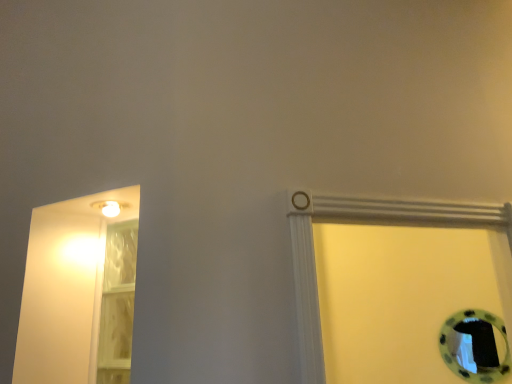
This screenshot has height=384, width=512. Describe the element at coordinates (117, 303) in the screenshot. I see `transparent plastic door at left` at that location.

Identify the location of transparent plastic door at left. The width and height of the screenshot is (512, 384). (117, 303).

Image resolution: width=512 pixels, height=384 pixels. I want to click on white glossy light fixture at upper left, so click(110, 207).

What do you see at coordinates (110, 207) in the screenshot?
I see `white glossy light fixture at upper left` at bounding box center [110, 207].

Locate an element on the screen. transparent plastic door at left is located at coordinates (117, 303).

Considering the relative positions of transparent plastic door at left and white glossy light fixture at upper left in the image provided, is transparent plastic door at left to the left of white glossy light fixture at upper left from the viewer's perspective?

No, transparent plastic door at left is not to the left of white glossy light fixture at upper left.

Consider the image. Is transparent plastic door at left in front of or behind white glossy light fixture at upper left in the image?

In the image, transparent plastic door at left appears behind white glossy light fixture at upper left.

Is point (124, 294) farther from camera compared to point (102, 209)?

Yes, it is behind point (102, 209).

From the image's perspective, relative to white glossy light fixture at upper left, is transparent plastic door at left above or below?

From the image's perspective, transparent plastic door at left appears below white glossy light fixture at upper left.

From a real-world perspective, who is located lower, transparent plastic door at left or white glossy light fixture at upper left?

In real-world perspective, transparent plastic door at left is lower.

Is transparent plastic door at left wider than white glossy light fixture at upper left?

Incorrect, the width of transparent plastic door at left does not surpass that of white glossy light fixture at upper left.

Considering the sizes of objects transparent plastic door at left and white glossy light fixture at upper left in the image provided, who is shorter, transparent plastic door at left or white glossy light fixture at upper left?

With less height is white glossy light fixture at upper left.

Considering the relative sizes of transparent plastic door at left and white glossy light fixture at upper left in the image provided, is transparent plastic door at left bigger than white glossy light fixture at upper left?

Indeed, transparent plastic door at left has a larger size compared to white glossy light fixture at upper left.

Could white glossy light fixture at upper left be considered to be inside transparent plastic door at left?

No, white glossy light fixture at upper left is located outside of transparent plastic door at left.

Is transparent plastic door at left in contact with white glossy light fixture at upper left?

transparent plastic door at left and white glossy light fixture at upper left are clearly separated.

Could you tell me if transparent plastic door at left is facing white glossy light fixture at upper left?

Yes, transparent plastic door at left is facing white glossy light fixture at upper left.

Can you tell me how much transparent plastic door at left and white glossy light fixture at upper left differ in facing direction?

transparent plastic door at left and white glossy light fixture at upper left are facing 2.41 degrees away from each other.

Measure the distance from transparent plastic door at left to white glossy light fixture at upper left.

A distance of 11.19 inches exists between transparent plastic door at left and white glossy light fixture at upper left.

I want to click on glass door that is under the white glossy light fixture at upper left (from a real-world perspective), so click(x=117, y=303).

In the scene shown: In the image, is white glossy light fixture at upper left on the left side or the right side of transparent plastic door at left?

In the image, white glossy light fixture at upper left appears on the left side of transparent plastic door at left.

Considering the relative positions of white glossy light fixture at upper left and transparent plastic door at left in the image provided, is white glossy light fixture at upper left behind transparent plastic door at left?

No, it is not.

Is point (120, 210) positioned in front of point (114, 288)?

Yes, it is in front of point (114, 288).

From the image's perspective, is white glossy light fixture at upper left located beneath transparent plastic door at left?

Actually, white glossy light fixture at upper left appears above transparent plastic door at left in the image.

From a real-world perspective, which is physically below, white glossy light fixture at upper left or transparent plastic door at left?

From a 3D spatial view, transparent plastic door at left is below.

Does white glossy light fixture at upper left have a greater width compared to transparent plastic door at left?

Yes.

Can you confirm if white glossy light fixture at upper left is taller than transparent plastic door at left?

In fact, white glossy light fixture at upper left may be shorter than transparent plastic door at left.

Considering the relative sizes of white glossy light fixture at upper left and transparent plastic door at left in the image provided, is white glossy light fixture at upper left bigger than transparent plastic door at left?

Incorrect, white glossy light fixture at upper left is not larger than transparent plastic door at left.

Is white glossy light fixture at upper left completely or partially outside of transparent plastic door at left?

Yes, white glossy light fixture at upper left is located beyond the bounds of transparent plastic door at left.

Is white glossy light fixture at upper left with transparent plastic door at left?

No, white glossy light fixture at upper left is not in contact with transparent plastic door at left.

Could you tell me if white glossy light fixture at upper left is facing transparent plastic door at left?

No, white glossy light fixture at upper left is not aimed at transparent plastic door at left.

Measure the distance between white glossy light fixture at upper left and transparent plastic door at left.

A distance of 11.19 inches exists between white glossy light fixture at upper left and transparent plastic door at left.

The height and width of the screenshot is (384, 512). In order to click on light fixture on the left of the transparent plastic door at left in this screenshot , I will do [x=110, y=207].

Locate an element on the screen. This screenshot has height=384, width=512. glass door below the white glossy light fixture at upper left (from a real-world perspective) is located at coordinates 117,303.

You are a GUI agent. You are given a task and a screenshot of the screen. Output one action in this format:
    pyautogui.click(x=<x>, y=<y>)
    Task: Click on the light fixture above the transparent plastic door at left (from a real-world perspective)
    Image resolution: width=512 pixels, height=384 pixels.
    Given the screenshot: What is the action you would take?
    pos(110,207)